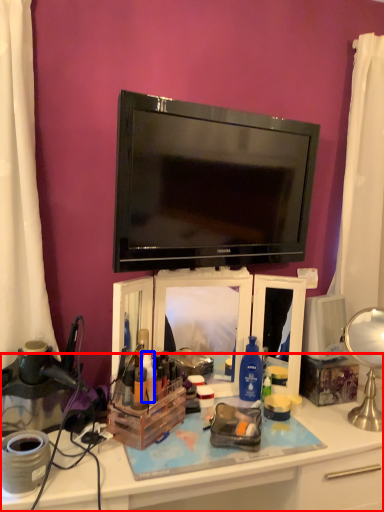
Question: Which of the following is the farthest to the observer, desk (highlighted by a red box) or toiletry (highlighted by a blue box)?

Choices:
 (A) desk
 (B) toiletry

Answer: (B)